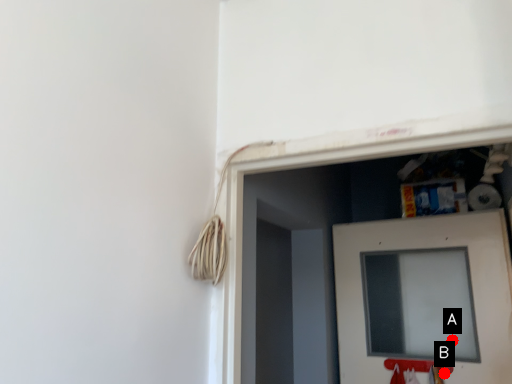
Question: Two points are circled on the image, labeled by A and B beside each circle. Which point appears closest to the camera in this image?

Choices:
 (A) A is closer
 (B) B is closer

Answer: (B)